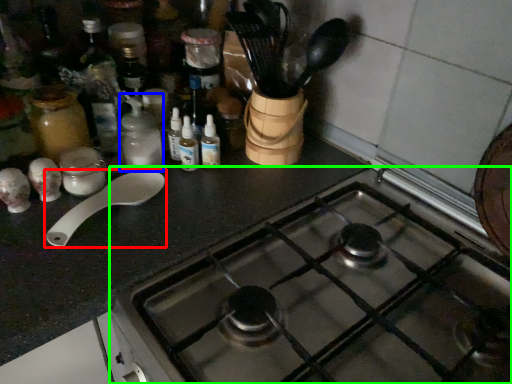
Question: Based on their relative distances, which object is farther from spoon (highlighted by a red box)? Choose from bottle (highlighted by a blue box) and gas stove (highlighted by a green box).

Choices:
 (A) bottle
 (B) gas stove

Answer: (B)